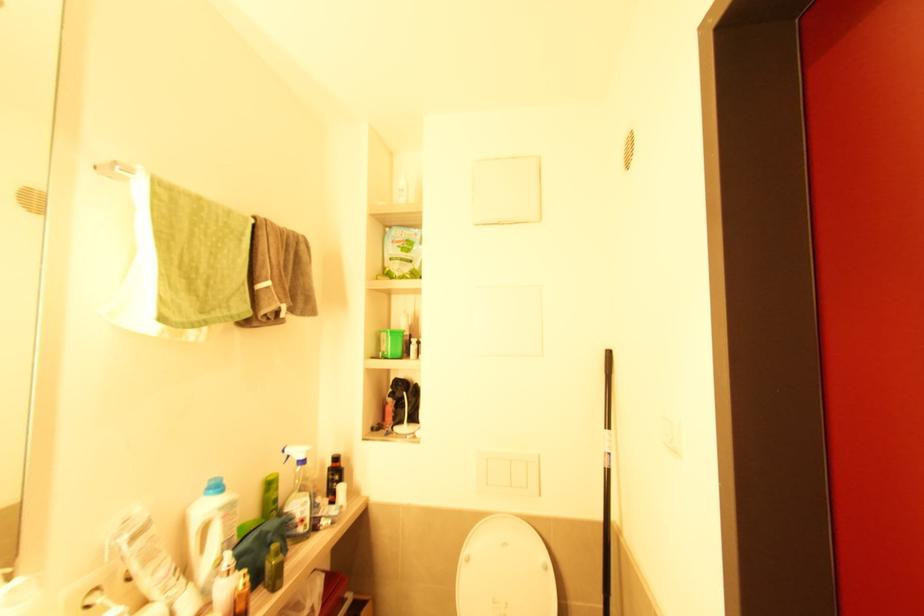
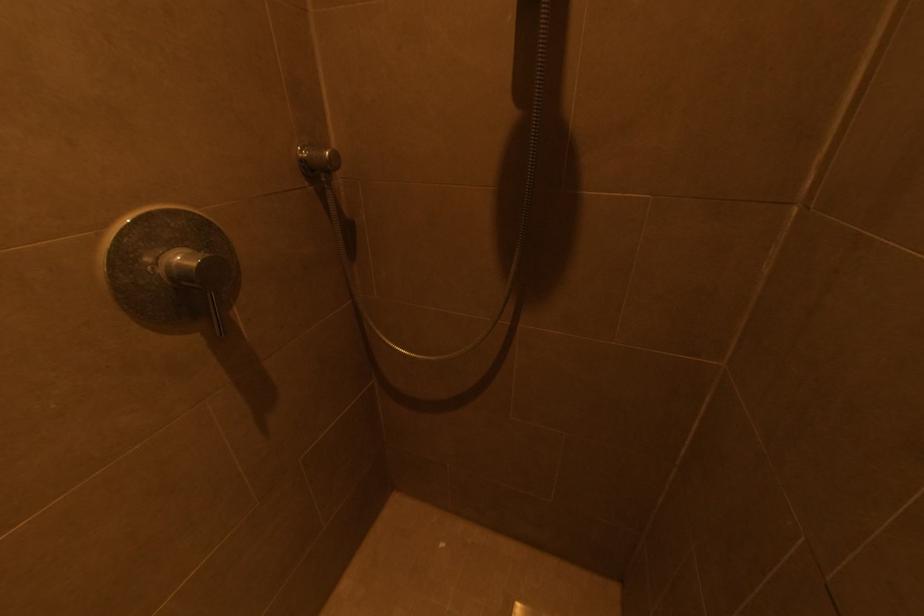
First-person continuous shooting, in which direction is the camera rotating?

The rotation direction of the camera is left-down.